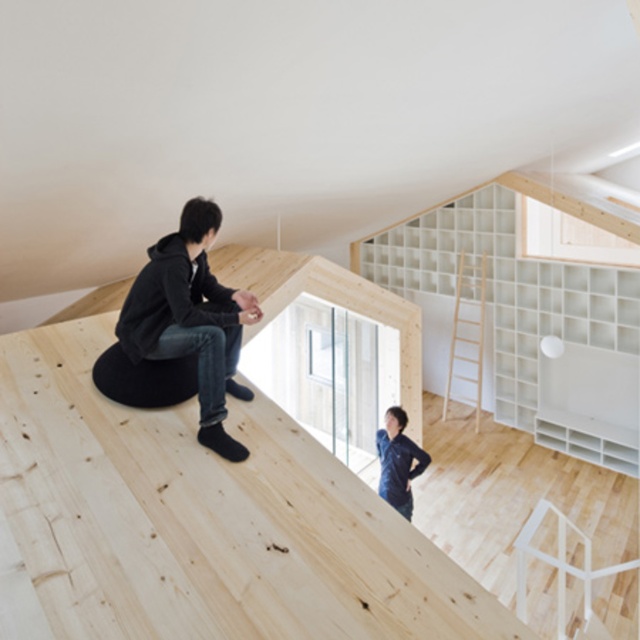
You are planning to place a small table between the black matte bean bag at upper left and the dark blue fabric at upper center. According to the scene description, where exactly should the table be placed?

The black matte bean bag at upper left is positioned over the dark blue fabric at upper center, so placing the table between them would require positioning it just below the bean bag where the dark blue fabric is visible underneath.

You are planning to place a new plant stand in the room. The plant stand requires a space that is not occupied by the black matte bean bag at upper left. Where should you avoid placing the plant stand?

You should avoid placing the plant stand at point (192, 320) where the black matte bean bag at upper left is located.